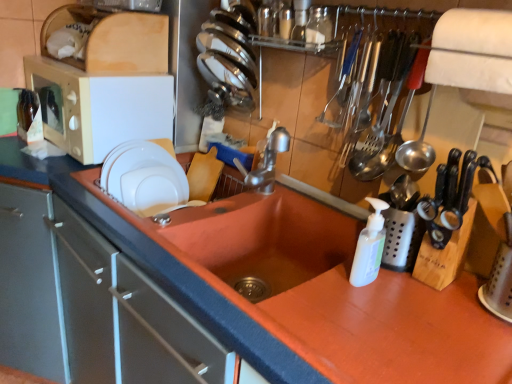
Image resolution: width=512 pixels, height=384 pixels. What do you see at coordinates (98, 107) in the screenshot?
I see `matte white microwave at left` at bounding box center [98, 107].

This screenshot has height=384, width=512. I want to click on matte white microwave at left, so click(x=98, y=107).

Image resolution: width=512 pixels, height=384 pixels. Describe the element at coordinates (387, 108) in the screenshot. I see `metallic silverware at upper right` at that location.

What is the approximate height of silver metallic faucet at center?

silver metallic faucet at center is 5.99 inches tall.

Where is `white fabric exhaust hood at upper right`? white fabric exhaust hood at upper right is located at coordinates (472, 50).

Does white fabric exhaust hood at upper right have a greater width compared to translucent amber glass at upper left, arranged as the second bottle when viewed from the top?

Correct, the width of white fabric exhaust hood at upper right exceeds that of translucent amber glass at upper left, arranged as the second bottle when viewed from the top.

Is white fabric exhaust hood at upper right positioned far away from translucent amber glass at upper left, which is the 1th bottle in back-to-front order?

Yes, white fabric exhaust hood at upper right and translucent amber glass at upper left, which is the 1th bottle in back-to-front order, are quite far apart.

How far apart are white fabric exhaust hood at upper right and translucent amber glass at upper left, which is the 1th bottle in back-to-front order?

white fabric exhaust hood at upper right and translucent amber glass at upper left, which is the 1th bottle in back-to-front order, are 4.21 feet apart.

From the image's perspective, which object appears higher, transparent glass jar at upper center, which is counted as the 1th bottle, starting from the top, or matte white microwave at left?

transparent glass jar at upper center, which is counted as the 1th bottle, starting from the top, appears higher in the image.

Considering the sizes of objects transparent glass jar at upper center, the second bottle in the bottom-to-top sequence, and matte white microwave at left in the image provided, who is shorter, transparent glass jar at upper center, the second bottle in the bottom-to-top sequence, or matte white microwave at left?

transparent glass jar at upper center, the second bottle in the bottom-to-top sequence, is shorter.

Could you tell me if transparent glass jar at upper center, the 1th bottle from the front, is turned towards matte white microwave at left?

No, transparent glass jar at upper center, the 1th bottle from the front, is not facing towards matte white microwave at left.

This screenshot has height=384, width=512. Find the location of `bottle positioned vertically above the matte white microwave at left (from a real-world perspective)`. bottle positioned vertically above the matte white microwave at left (from a real-world perspective) is located at coordinates (318, 26).

Who is smaller, translucent amber glass at upper left, the first bottle positioned from the bottom, or shiny stainless steel plates at upper center, which is the second tableware from left to right?

Smaller between the two is translucent amber glass at upper left, the first bottle positioned from the bottom.

Considering the positions of points (22, 120) and (244, 63), is point (22, 120) farther from camera compared to point (244, 63)?

Yes, it is.

Can you tell me how much translucent amber glass at upper left, which is the 1th bottle in back-to-front order, and shiny stainless steel plates at upper center, acting as the 1th tableware starting from the top, differ in facing direction?

They differ by 89.5 degrees in their facing directions.

Would you say translucent amber glass at upper left, which is the 1th bottle in back-to-front order, is to the left or to the right of shiny stainless steel plates at upper center, acting as the 1th tableware starting from the top, in the picture?

Clearly, translucent amber glass at upper left, which is the 1th bottle in back-to-front order, is on the left of shiny stainless steel plates at upper center, acting as the 1th tableware starting from the top, in the image.

In the scene shown: Considering the sizes of translucent amber glass at upper left, which is the 2th bottle from front to back, and matte white drawer at left in the image, is translucent amber glass at upper left, which is the 2th bottle from front to back, wider or thinner than matte white drawer at left?

Clearly, translucent amber glass at upper left, which is the 2th bottle from front to back, has less width compared to matte white drawer at left.

Which is nearer, (x=33, y=124) or (x=71, y=237)?

The point (x=71, y=237) is more forward.

Between translucent amber glass at upper left, the first bottle from the left, and matte white drawer at left, which one appears on the left side from the viewer's perspective?

translucent amber glass at upper left, the first bottle from the left, is more to the left.

Measure the distance from translucent amber glass at upper left, the 2th bottle viewed from the right, to matte white drawer at left.

The distance of translucent amber glass at upper left, the 2th bottle viewed from the right, from matte white drawer at left is 26.10 inches.

Is white fabric exhaust hood at upper right situated inside silver metallic faucet at center or outside?

The correct answer is: outside.

Considering the sizes of objects white fabric exhaust hood at upper right and silver metallic faucet at center in the image provided, who is bigger, white fabric exhaust hood at upper right or silver metallic faucet at center?

With larger size is white fabric exhaust hood at upper right.

From the image's perspective, who appears lower, white fabric exhaust hood at upper right or silver metallic faucet at center?

silver metallic faucet at center is shown below in the image.

Is white fabric exhaust hood at upper right next to silver metallic faucet at center and touching it?

No, white fabric exhaust hood at upper right is not beside silver metallic faucet at center.

From the image's perspective, count 2nd bottles upward from the matte white drawer at left and point to it. Please provide its 2D coordinates.

[(318, 26)]

Is point (323, 35) more distant than point (191, 382)?

Yes, point (323, 35) is behind point (191, 382).

Consider the image. Between transparent glass jar at upper center, positioned as the second bottle in left-to-right order, and matte white drawer at left, which one has more height?

matte white drawer at left is taller.

Is transparent glass jar at upper center, the second bottle in the bottom-to-top sequence, facing towards matte white drawer at left?

No, transparent glass jar at upper center, the second bottle in the bottom-to-top sequence, does not turn towards matte white drawer at left.

Considering the positions of objects transparent glass jar at upper center, the second bottle in the bottom-to-top sequence, and translucent amber glass at upper left, arranged as the second bottle when viewed from the top, in the image provided, who is in front, transparent glass jar at upper center, the second bottle in the bottom-to-top sequence, or translucent amber glass at upper left, arranged as the second bottle when viewed from the top,?

transparent glass jar at upper center, the second bottle in the bottom-to-top sequence, is in front.

Consider the image. Is transparent glass jar at upper center, the second bottle in the bottom-to-top sequence, bigger or smaller than translucent amber glass at upper left, the 2th bottle viewed from the right?

In the image, transparent glass jar at upper center, the second bottle in the bottom-to-top sequence, appears to be smaller than translucent amber glass at upper left, the 2th bottle viewed from the right.

From the image's perspective, which one is positioned lower, transparent glass jar at upper center, the 1th bottle from the front, or translucent amber glass at upper left, arranged as the second bottle when viewed from the top?

From the image's view, translucent amber glass at upper left, arranged as the second bottle when viewed from the top, is below.

Image resolution: width=512 pixels, height=384 pixels. I want to click on exhaust hood above the translucent amber glass at upper left, which is the 1th bottle in back-to-front order (from the image's perspective), so click(472, 50).

I want to click on bottle located above the matte white microwave at left (from a real-world perspective), so click(x=318, y=26).

Based on their spatial positions, is white matte plate at upper left, the second tableware viewed from the right, or silver metallic faucet at center further from shiny stainless steel plates at upper center, which is the second tableware from left to right?

white matte plate at upper left, the second tableware viewed from the right, lies further to shiny stainless steel plates at upper center, which is the second tableware from left to right, than the other object.

From the image, which object appears to be nearer to shiny stainless steel plates at upper center, positioned as the first tableware in right-to-left order, silver metallic faucet at center or matte white drawer at left?

silver metallic faucet at center is closer to shiny stainless steel plates at upper center, positioned as the first tableware in right-to-left order.

Which object lies further to the anchor point translucent amber glass at upper left, arranged as the second bottle when viewed from the top, matte white drawer at left or transparent glass jar at upper center, the 1th bottle from the front?

The object further to translucent amber glass at upper left, arranged as the second bottle when viewed from the top, is transparent glass jar at upper center, the 1th bottle from the front.

From the image, which object appears to be nearer to white fabric exhaust hood at upper right, metallic silverware at upper right or silver metallic faucet at center?

metallic silverware at upper right.

Estimate the real-world distances between objects in this image. Which object is closer to white matte plate at upper left, the second tableware viewed from the right, metallic silverware at upper right or white fabric exhaust hood at upper right?

Based on the image, metallic silverware at upper right appears to be nearer to white matte plate at upper left, the second tableware viewed from the right.

From the image, which object appears to be farther from shiny stainless steel plates at upper center, acting as the second tableware starting from the bottom, matte white drawer at left or translucent amber glass at upper left, which is the 1th bottle in back-to-front order?

matte white drawer at left.

Which object lies nearer to the anchor point matte white drawer at left, white fabric exhaust hood at upper right or transparent glass jar at upper center, the second bottle in the bottom-to-top sequence?

Among the two, white fabric exhaust hood at upper right is located nearer to matte white drawer at left.

Which object lies further to the anchor point transparent glass jar at upper center, the 1th bottle from the front, shiny stainless steel plates at upper center, which is the second tableware from left to right, or translucent amber glass at upper left, the 2th bottle viewed from the right?

The object further to transparent glass jar at upper center, the 1th bottle from the front, is translucent amber glass at upper left, the 2th bottle viewed from the right.

Where is `silverware situated between matte white drawer at left and white fabric exhaust hood at upper right from left to right`? Image resolution: width=512 pixels, height=384 pixels. silverware situated between matte white drawer at left and white fabric exhaust hood at upper right from left to right is located at coordinates (387, 108).

I want to click on bottle between matte white drawer at left and white fabric exhaust hood at upper right in the horizontal direction, so click(318, 26).

The width and height of the screenshot is (512, 384). I want to click on silverware between matte white microwave at left and white fabric exhaust hood at upper right, so click(387, 108).

This screenshot has height=384, width=512. Find the location of `tap between shiny stainless steel plates at upper center, which is the second tableware from left to right, and metallic silverware at upper right from left to right`. tap between shiny stainless steel plates at upper center, which is the second tableware from left to right, and metallic silverware at upper right from left to right is located at coordinates (266, 162).